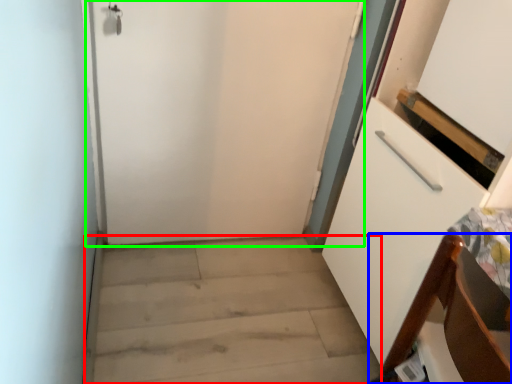
Question: Which is farther away from stairwell (highlighted by a red box)? furniture (highlighted by a blue box) or door (highlighted by a green box)?

Choices:
 (A) furniture
 (B) door

Answer: (A)